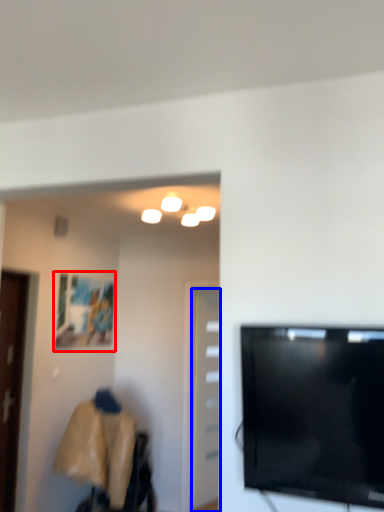
Question: Which of the following is the closest to the observer, picture frame (highlighted by a red box) or door (highlighted by a blue box)?

Choices:
 (A) picture frame
 (B) door

Answer: (A)